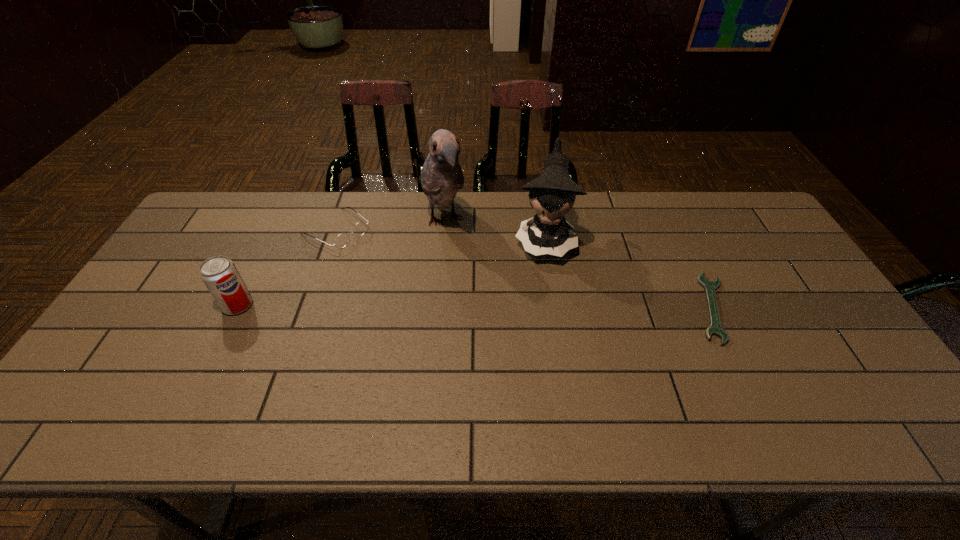
You are a GUI agent. You are given a task and a screenshot of the screen. Output one action in this format:
    pyautogui.click(x=<x>, y=<y>)
    Task: Click on the third tallest object
    The image size is (960, 540).
    Given the screenshot: What is the action you would take?
    pyautogui.click(x=221, y=277)

I want to click on the leftmost object, so click(x=221, y=277).

Identify the location of the rightmost object. This screenshot has width=960, height=540. (715, 329).

You are a GUI agent. You are given a task and a screenshot of the screen. Output one action in this format:
    pyautogui.click(x=<x>, y=<y>)
    Task: Click on the shortest object
    
    Given the screenshot: What is the action you would take?
    pyautogui.click(x=715, y=329)

This screenshot has height=540, width=960. What are the coordinates of `the second tallest object` in the screenshot? It's located at (553, 193).

You are a GUI agent. You are given a task and a screenshot of the screen. Output one action in this format:
    pyautogui.click(x=<x>, y=<y>)
    Task: Click on the fourth object from left to right
    
    Given the screenshot: What is the action you would take?
    pyautogui.click(x=553, y=193)

The width and height of the screenshot is (960, 540). Find the location of `the second shortest object`. the second shortest object is located at coordinates (342, 239).

You are a GUI agent. You are given a task and a screenshot of the screen. Output one action in this format:
    pyautogui.click(x=<x>, y=<y>)
    Task: Click on the second object from left to right
    The image size is (960, 540).
    Given the screenshot: What is the action you would take?
    pyautogui.click(x=342, y=239)

Find the location of a particular element. The height and width of the screenshot is (540, 960). parrot is located at coordinates (441, 176).

Where is `the third object from right to left`? the third object from right to left is located at coordinates (441, 176).